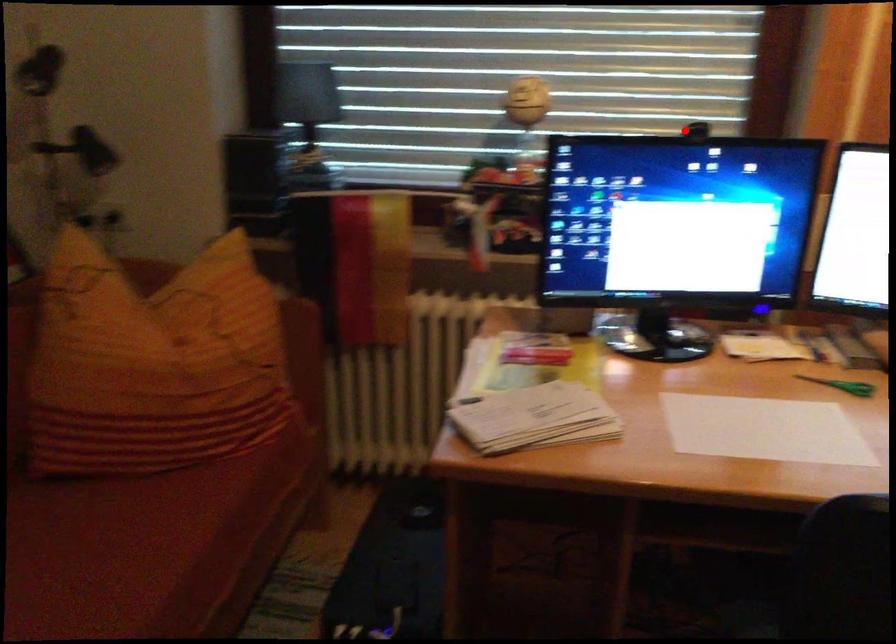
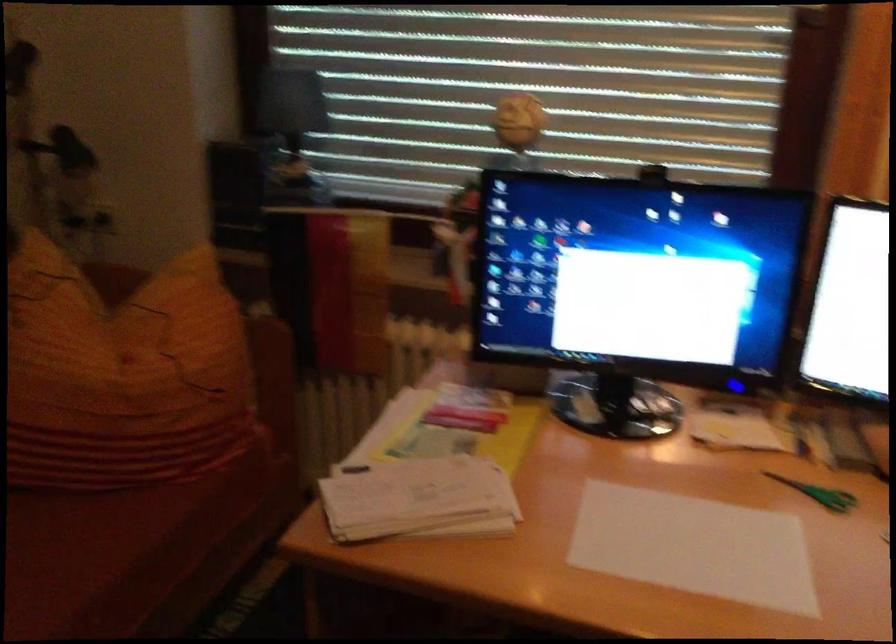
The point at the highlighted location is marked in the first image. Where is the corresponding point in the second image?

(650, 174)